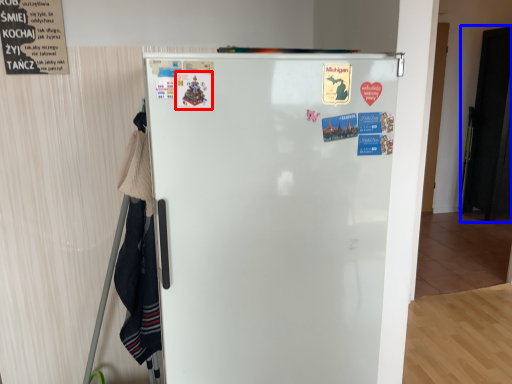
Question: Which object is further to the camera taking this photo, poster (highlighted by a red box) or door (highlighted by a blue box)?

Choices:
 (A) poster
 (B) door

Answer: (B)